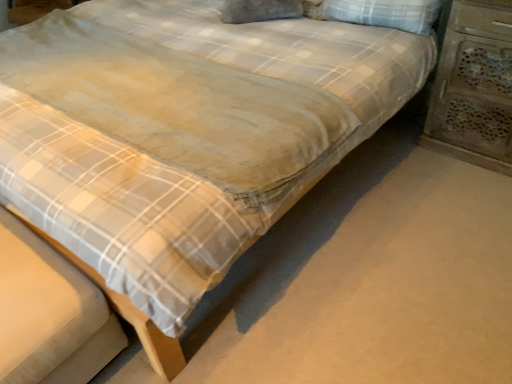
Question: From the image's perspective, is white checkered pillow at upper right located above or below wooden carved nightstand at right?

Choices:
 (A) below
 (B) above

Answer: (B)

Question: Does point (328, 1) appear closer or farther from the camera than point (431, 130)?

Choices:
 (A) closer
 (B) farther

Answer: (A)

Question: Is white checkered pillow at upper right wider or thinner than wooden carved nightstand at right?

Choices:
 (A) wide
 (B) thin

Answer: (B)

Question: Is wooden carved nightstand at right taller or shorter than white checkered pillow at upper right?

Choices:
 (A) short
 (B) tall

Answer: (B)

Question: In the image, is wooden carved nightstand at right on the left side or the right side of white checkered pillow at upper right?

Choices:
 (A) left
 (B) right

Answer: (B)

Question: From a real-world perspective, is wooden carved nightstand at right positioned above or below white checkered pillow at upper right?

Choices:
 (A) below
 (B) above

Answer: (A)

Question: In the image, is wooden carved nightstand at right positioned in front of or behind white checkered pillow at upper right?

Choices:
 (A) behind
 (B) front

Answer: (B)